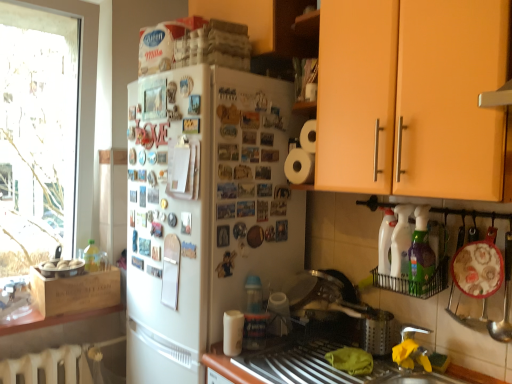
Question: Considering the relative positions of silver metallic faucet at lower right and transparent glass window at left in the image provided, is silver metallic faucet at lower right to the right of transparent glass window at left from the viewer's perspective?

Choices:
 (A) yes
 (B) no

Answer: (A)

Question: Considering the relative sizes of silver metallic faucet at lower right and transparent glass window at left in the image provided, is silver metallic faucet at lower right wider than transparent glass window at left?

Choices:
 (A) yes
 (B) no

Answer: (B)

Question: Is silver metallic faucet at lower right behind transparent glass window at left?

Choices:
 (A) yes
 (B) no

Answer: (B)

Question: Is silver metallic faucet at lower right not within transparent glass window at left?

Choices:
 (A) no
 (B) yes

Answer: (B)

Question: Is silver metallic faucet at lower right positioned before transparent glass window at left?

Choices:
 (A) yes
 (B) no

Answer: (A)

Question: Would you say metallic silver sink at lower center is to the left or to the right of white matte paper towel at lower center in the picture?

Choices:
 (A) left
 (B) right

Answer: (B)

Question: Would you say metallic silver sink at lower center is inside or outside white matte paper towel at lower center?

Choices:
 (A) outside
 (B) inside

Answer: (A)

Question: From a real-world perspective, is metallic silver sink at lower center positioned above or below white matte paper towel at lower center?

Choices:
 (A) below
 (B) above

Answer: (A)

Question: In the image, is metallic silver sink at lower center positioned in front of or behind white matte paper towel at lower center?

Choices:
 (A) front
 (B) behind

Answer: (A)

Question: Is white glossy bottle at right, which is counted as the 2th bottle, starting from the front, wider or thinner than white matte refrigerator at center?

Choices:
 (A) thin
 (B) wide

Answer: (A)

Question: In terms of size, does white glossy bottle at right, arranged as the 1th bottle when viewed from the back, appear bigger or smaller than white matte refrigerator at center?

Choices:
 (A) big
 (B) small

Answer: (B)

Question: Do you think white glossy bottle at right, arranged as the 1th bottle when viewed from the back, is within white matte refrigerator at center, or outside of it?

Choices:
 (A) inside
 (B) outside

Answer: (B)

Question: From a real-world perspective, is white glossy bottle at right, which is counted as the 2th bottle, starting from the front, physically located above or below white matte refrigerator at center?

Choices:
 (A) below
 (B) above

Answer: (B)

Question: Is metallic silver sink at lower center in front of or behind white matte refrigerator at center in the image?

Choices:
 (A) behind
 (B) front

Answer: (B)

Question: From a real-world perspective, is metallic silver sink at lower center positioned above or below white matte refrigerator at center?

Choices:
 (A) below
 (B) above

Answer: (A)